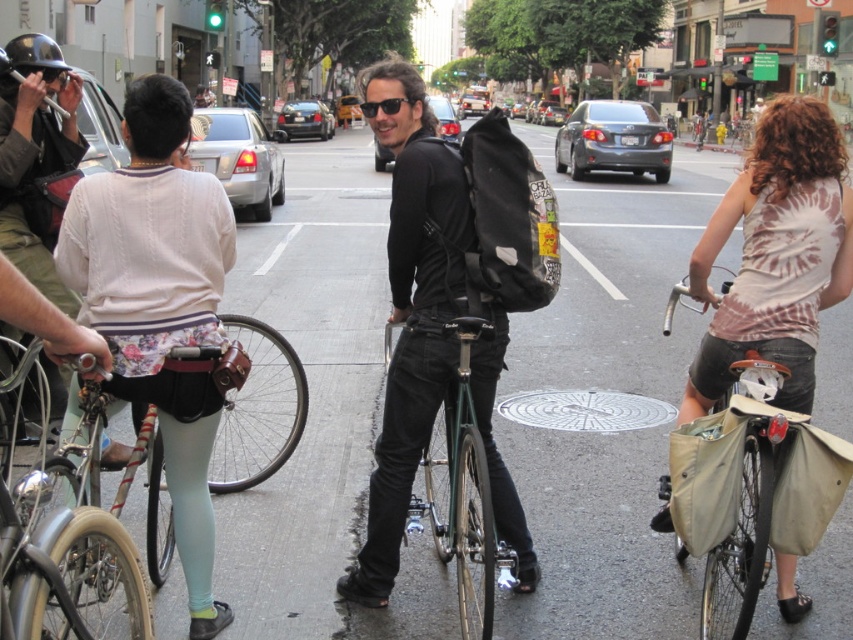
Question: Which point is closer to the camera taking this photo?

Choices:
 (A) (718, 611)
 (B) (442, 262)
 (C) (4, 52)

Answer: (B)

Question: Is black matte backpack at center further to the viewer compared to green metallic bicycle at center?

Choices:
 (A) yes
 (B) no

Answer: (A)

Question: Based on their relative distances, which object is farther from the green metallic bicycle at center?

Choices:
 (A) silver metallic bicycle at left
 (B) black matte bicycle helmet at upper left

Answer: (B)

Question: Which point is farther to the camera?

Choices:
 (A) beige canvas bag at right
 (B) metallic silver bicycle at center
 (C) shiny black helmet at upper left
 (D) black matte bicycle helmet at upper left

Answer: (B)

Question: Is silver metallic bicycle at left further to the viewer compared to white tie-dye tank top at right?

Choices:
 (A) no
 (B) yes

Answer: (A)

Question: Does shiny black helmet at upper left appear over black matte bicycle helmet at upper left?

Choices:
 (A) no
 (B) yes

Answer: (B)